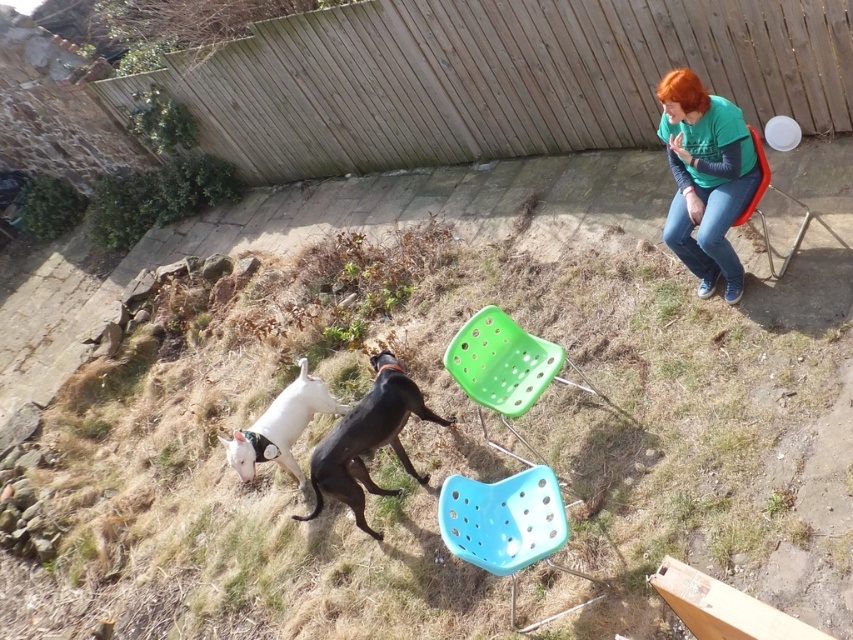
Question: Does wooden fence at upper center have a greater width compared to black matte dog at lower center?

Choices:
 (A) no
 (B) yes

Answer: (A)

Question: In this image, where is green fabric shirt at upper right located relative to black matte dog at lower center?

Choices:
 (A) right
 (B) left

Answer: (A)

Question: Is black matte dog at lower center wider than white glossy dog at lower left?

Choices:
 (A) no
 (B) yes

Answer: (B)

Question: Based on their relative distances, which object is nearer to the green plastic chair at center?

Choices:
 (A) blue plastic chair at lower center
 (B) white glossy dog at lower left
 (C) black matte dog at lower center
 (D) wooden fence at upper center

Answer: (C)

Question: Which of the following is the closest to the observer?

Choices:
 (A) (683, 129)
 (B) (289, 435)
 (C) (372, 100)

Answer: (A)

Question: Which of the following is the closest to the observer?

Choices:
 (A) (294, 420)
 (B) (399, 378)
 (C) (672, 76)
 (D) (596, 81)

Answer: (C)